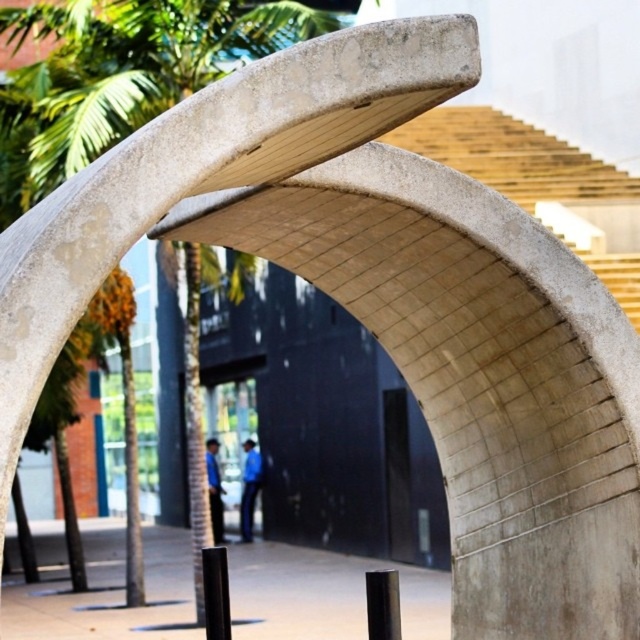
Does smooth concrete post at center appear on the right side of blue shirt at center?

Yes, smooth concrete post at center is to the right of blue shirt at center.

Is point (102, 604) in front of point (212, 474)?

Yes.

You are a GUI agent. You are given a task and a screenshot of the screen. Output one action in this format:
    pyautogui.click(x=<x>, y=<y>)
    Task: Click on the smooth concrete post at center
    This screenshot has height=640, width=640.
    Given the screenshot: What is the action you would take?
    pyautogui.click(x=100, y=588)

Describe the element at coordinates (250, 488) in the screenshot. I see `blue fabric pants at center` at that location.

Between blue fabric pants at center and blue shirt at center, which one appears on the right side from the viewer's perspective?

blue fabric pants at center

This screenshot has height=640, width=640. What do you see at coordinates (250, 488) in the screenshot?
I see `blue fabric pants at center` at bounding box center [250, 488].

You are a GUI agent. You are given a task and a screenshot of the screen. Output one action in this format:
    pyautogui.click(x=<x>, y=<y>)
    Task: Click on the blue fabric pants at center
    The height and width of the screenshot is (640, 640).
    Given the screenshot: What is the action you would take?
    click(250, 488)

Does point (272, 560) lie behind point (246, 484)?

No, it is not.

Between point (332, 588) and point (253, 481), which one is positioned behind?

The point (253, 481) is behind.

Describe the element at coordinates (100, 588) in the screenshot. I see `smooth concrete post at center` at that location.

Identify the location of smooth concrete post at center. This screenshot has height=640, width=640. (100, 588).